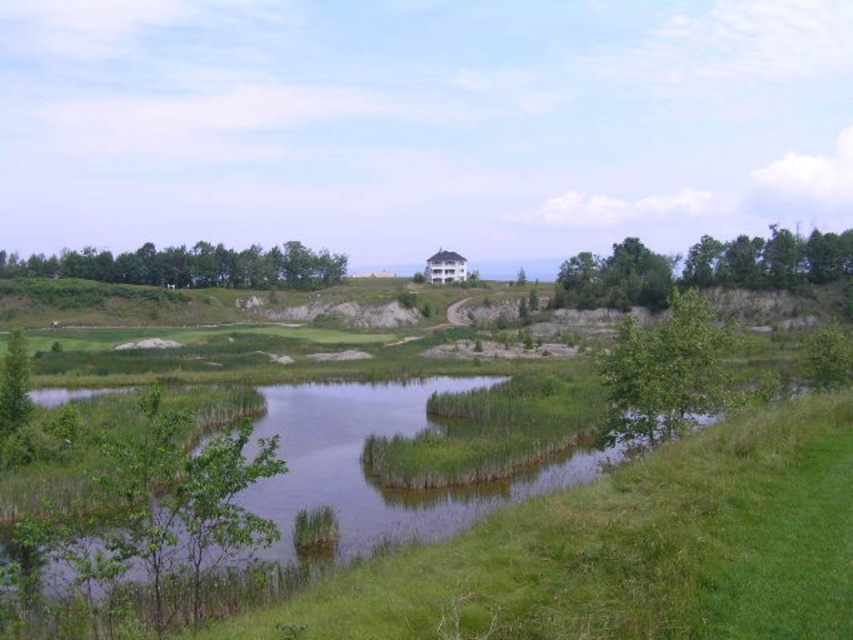
You are standing at the center of the image and want to walk towards the green leafy trees at right. Which direction should you head to avoid the green leafy trees at upper left?

Since the green leafy trees at right is below the green leafy trees at upper left, you should head downward to reach the green leafy trees at right while avoiding the green leafy trees at upper left.

You are standing at the point marked as point (701, 268) in the image. Which direction should you walk to reach the grassy area in the foreground?

The point (701, 268) is on green leafy trees at right, so you should walk towards the left to reach the grassy area in the foreground.